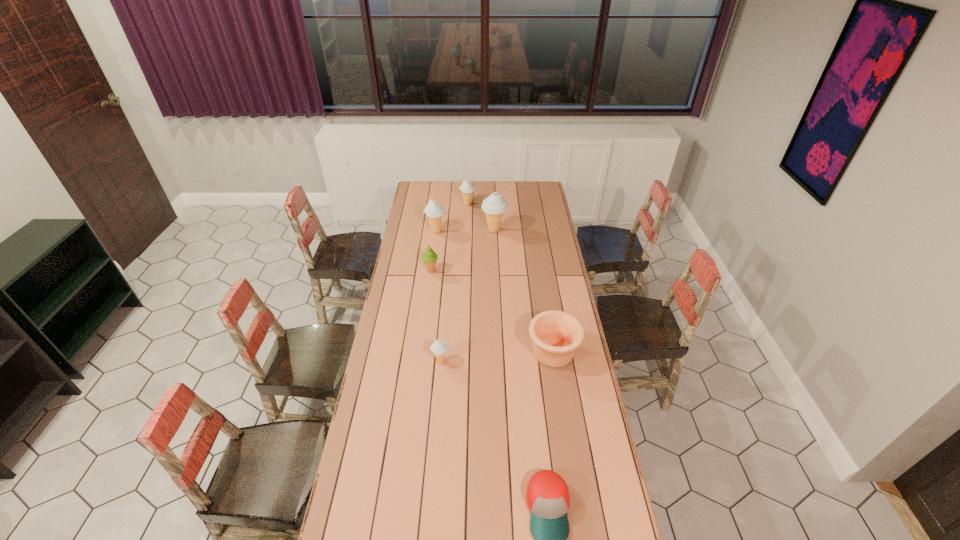
Where is `free space that satisfies the following two spatial constraints: 1. on the front side of the nearest beige icecream; 2. on the right side of the second nearest icecream`? free space that satisfies the following two spatial constraints: 1. on the front side of the nearest beige icecream; 2. on the right side of the second nearest icecream is located at coordinates (420, 361).

Where is `free space that satisfies the following two spatial constraints: 1. on the back side of the nearest beige icecream; 2. on the right side of the biggest beige icecream`? free space that satisfies the following two spatial constraints: 1. on the back side of the nearest beige icecream; 2. on the right side of the biggest beige icecream is located at coordinates (451, 230).

Where is `blank area in the image that satisfies the following two spatial constraints: 1. on the back side of the pottery; 2. on the right side of the shortest icecream`? blank area in the image that satisfies the following two spatial constraints: 1. on the back side of the pottery; 2. on the right side of the shortest icecream is located at coordinates (442, 353).